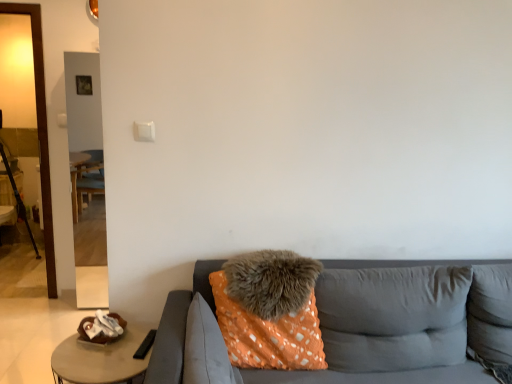
Question: Considering the relative sizes of gray fabric pillow at right, the first pillow in the right-to-left sequence, and black metal tripod at left in the image provided, is gray fabric pillow at right, the first pillow in the right-to-left sequence, wider than black metal tripod at left?

Choices:
 (A) yes
 (B) no

Answer: (B)

Question: Is black metal tripod at left a part of gray fabric pillow at right, which is counted as the 5th pillow, starting from the left?

Choices:
 (A) no
 (B) yes

Answer: (A)

Question: Is gray fabric pillow at right, the first pillow in the right-to-left sequence, with black metal tripod at left?

Choices:
 (A) no
 (B) yes

Answer: (A)

Question: Is gray fabric pillow at right, the first pillow in the right-to-left sequence, not inside black metal tripod at left?

Choices:
 (A) yes
 (B) no

Answer: (A)

Question: Does gray fabric pillow at right, the first pillow in the right-to-left sequence, have a lesser height compared to black metal tripod at left?

Choices:
 (A) no
 (B) yes

Answer: (B)

Question: Does gray fabric pillow at right, the first pillow in the right-to-left sequence, have a lesser width compared to black metal tripod at left?

Choices:
 (A) yes
 (B) no

Answer: (A)

Question: Is black metal tripod at left bigger than orange fuzzy pillow at center, placed as the fourth pillow when sorted from right to left?

Choices:
 (A) yes
 (B) no

Answer: (A)

Question: Is black metal tripod at left taller than orange fuzzy pillow at center, placed as the fourth pillow when sorted from right to left?

Choices:
 (A) no
 (B) yes

Answer: (B)

Question: Does black metal tripod at left come behind orange fuzzy pillow at center, the 2th pillow when ordered from left to right?

Choices:
 (A) yes
 (B) no

Answer: (A)

Question: Are black metal tripod at left and orange fuzzy pillow at center, the 2th pillow when ordered from left to right, beside each other?

Choices:
 (A) no
 (B) yes

Answer: (A)

Question: Can you confirm if black metal tripod at left is positioned to the right of orange fuzzy pillow at center, placed as the fourth pillow when sorted from right to left?

Choices:
 (A) yes
 (B) no

Answer: (B)

Question: From the image's perspective, is black metal tripod at left below orange fuzzy pillow at center, the 2th pillow when ordered from left to right?

Choices:
 (A) yes
 (B) no

Answer: (B)

Question: Is orange fabric couch at center aimed at gray fabric pillow at right, which is counted as the 5th pillow, starting from the left?

Choices:
 (A) yes
 (B) no

Answer: (B)